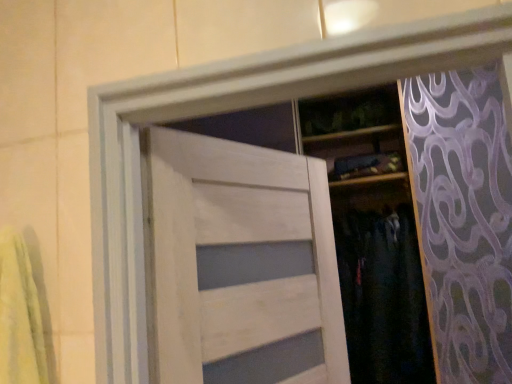
In order to face dark fabric pants at center, should I rotate leftwards or rightwards?

Rotate right and turn 16.373 degrees.

What do you see at coordinates (383, 297) in the screenshot? This screenshot has height=384, width=512. I see `dark fabric pants at center` at bounding box center [383, 297].

I want to click on dark fabric pants at center, so click(x=383, y=297).

This screenshot has width=512, height=384. In order to click on white wood door at center in this screenshot , I will do `click(243, 265)`.

This screenshot has height=384, width=512. Describe the element at coordinates (243, 265) in the screenshot. I see `white wood door at center` at that location.

This screenshot has width=512, height=384. In order to click on dark fabric pants at center in this screenshot , I will do `click(383, 297)`.

Does dark fabric pants at center appear on the left side of white wood door at center?

No.

Does dark fabric pants at center come in front of white wood door at center?

That is False.

Does point (408, 228) come farther from viewer compared to point (164, 335)?

Yes, it is behind point (164, 335).

From the image's perspective, is dark fabric pants at center above or below white wood door at center?

dark fabric pants at center is below white wood door at center.

From a real-world perspective, relative to white wood door at center, is dark fabric pants at center vertically above or below?

dark fabric pants at center is situated lower than white wood door at center in the real world.

Based on the photo, considering the relative sizes of dark fabric pants at center and white wood door at center in the image provided, is dark fabric pants at center wider than white wood door at center?

Indeed, dark fabric pants at center has a greater width compared to white wood door at center.

Does dark fabric pants at center have a greater height compared to white wood door at center?

Correct, dark fabric pants at center is much taller as white wood door at center.

Considering the sizes of objects dark fabric pants at center and white wood door at center in the image provided, who is bigger, dark fabric pants at center or white wood door at center?

dark fabric pants at center is bigger.

Is dark fabric pants at center not inside white wood door at center?

Absolutely, dark fabric pants at center is external to white wood door at center.

Is dark fabric pants at center placed right next to white wood door at center?

They are not placed beside each other.

Is dark fabric pants at center facing towards white wood door at center?

No, dark fabric pants at center does not turn towards white wood door at center.

How different are the orientations of dark fabric pants at center and white wood door at center in degrees?

The facing directions of dark fabric pants at center and white wood door at center are 62.5 degrees apart.

Measure the distance between dark fabric pants at center and white wood door at center.

A distance of 31.14 inches exists between dark fabric pants at center and white wood door at center.

At what (x,y) coordinates should I click in order to perform the action: click on clothing behind the white wood door at center. Please return your answer as a coordinate pair (x, y). The image size is (512, 384). Looking at the image, I should click on (383, 297).

Is white wood door at center to the right of dark fabric pants at center from the viewer's perspective?

Incorrect, white wood door at center is not on the right side of dark fabric pants at center.

Considering the positions of objects white wood door at center and dark fabric pants at center in the image provided, who is in front, white wood door at center or dark fabric pants at center?

white wood door at center.

Is point (310, 363) closer to viewer compared to point (386, 243)?

Yes, point (310, 363) is closer to viewer.

From the image's perspective, would you say white wood door at center is shown under dark fabric pants at center?

No, from the image's perspective, white wood door at center is not below dark fabric pants at center.

From a real-world perspective, which object rests below the other?

dark fabric pants at center, from a real-world perspective.

Does white wood door at center have a greater width compared to dark fabric pants at center?

No, white wood door at center is not wider than dark fabric pants at center.

Which of these two, white wood door at center or dark fabric pants at center, stands shorter?

white wood door at center is shorter.

Who is bigger, white wood door at center or dark fabric pants at center?

dark fabric pants at center.

Is white wood door at center located outside dark fabric pants at center?

Yes, white wood door at center is located beyond the bounds of dark fabric pants at center.

Are white wood door at center and dark fabric pants at center located far from each other?

That's not correct — white wood door at center is a little close to dark fabric pants at center.

Could you tell me if white wood door at center is facing dark fabric pants at center?

No, white wood door at center is not turned towards dark fabric pants at center.

How different are the orientations of white wood door at center and dark fabric pants at center in degrees?

white wood door at center and dark fabric pants at center are facing 62.5 degrees away from each other.

How distant is white wood door at center from dark fabric pants at center?

white wood door at center is 31.14 inches from dark fabric pants at center.

Locate an element on the screen. clothing that is under the white wood door at center (from a real-world perspective) is located at coordinates (383, 297).

Where is `door that appears on the left of dark fabric pants at center`? door that appears on the left of dark fabric pants at center is located at coordinates (243, 265).

The image size is (512, 384). I want to click on clothing below the white wood door at center (from a real-world perspective), so click(x=383, y=297).